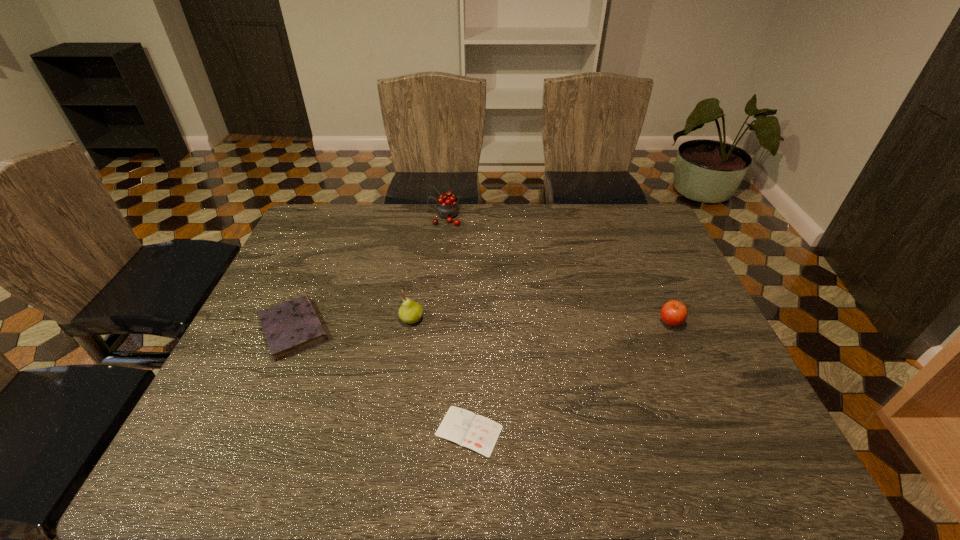
Find the location of `vacant space at the left edge of the desktop`. vacant space at the left edge of the desktop is located at coordinates (300, 264).

In the image, there is a desktop. Where is `vacant space at the right edge`? This screenshot has height=540, width=960. vacant space at the right edge is located at coordinates (643, 300).

In the image, there is a desktop. Where is `free space at the far left corner`? free space at the far left corner is located at coordinates (317, 207).

Image resolution: width=960 pixels, height=540 pixels. Find the location of `vacant space at the far right corner of the desktop`. vacant space at the far right corner of the desktop is located at coordinates (647, 243).

Identify the location of free spot between the right diary and the pear. The image size is (960, 540). (441, 375).

I want to click on vacant space that is in between the cherry and the rightmost object, so click(x=558, y=269).

Identify the location of vacant area that lies between the nearer diary and the taller diary. The image size is (960, 540). (381, 380).

I want to click on empty space that is in between the pear and the left diary, so click(x=352, y=324).

This screenshot has height=540, width=960. I want to click on empty space that is in between the taller diary and the pear, so click(352, 324).

Where is `free spot between the apple and the nearest object`? The height and width of the screenshot is (540, 960). free spot between the apple and the nearest object is located at coordinates (570, 376).